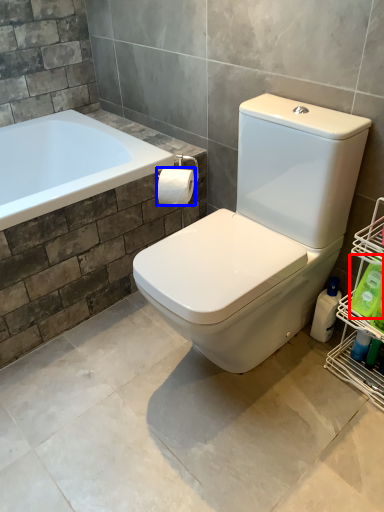
Question: Which object appears closest to the camera in this image, cleaning product (highlighted by a red box) or toilet paper (highlighted by a blue box)?

Choices:
 (A) cleaning product
 (B) toilet paper

Answer: (A)